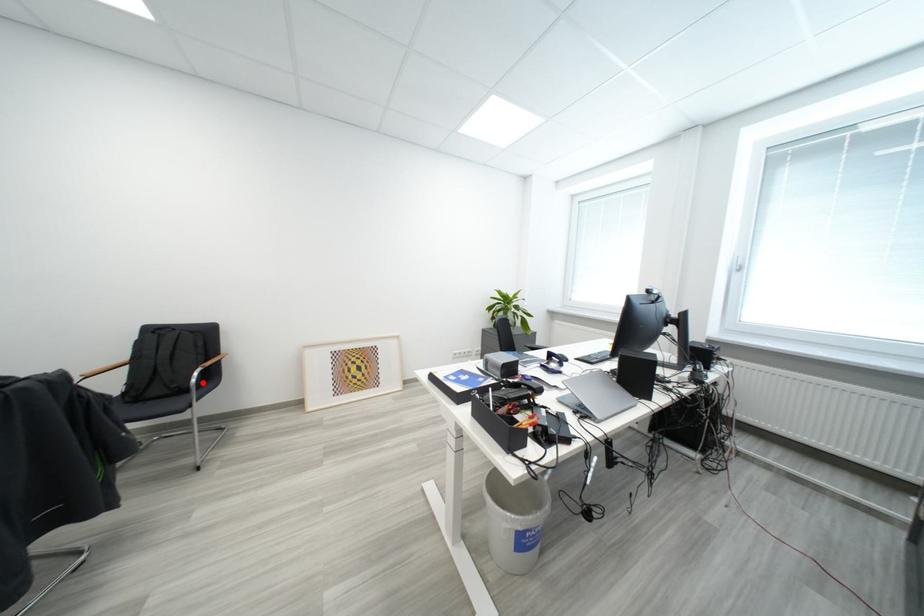
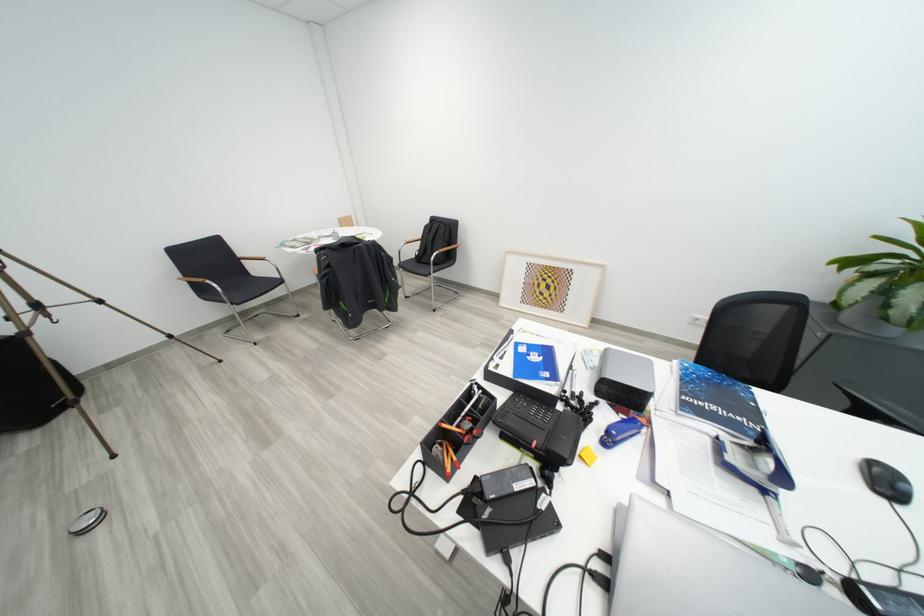
The point at the highlighted location is marked in the first image. Where is the corresponding point in the second image?

(442, 262)